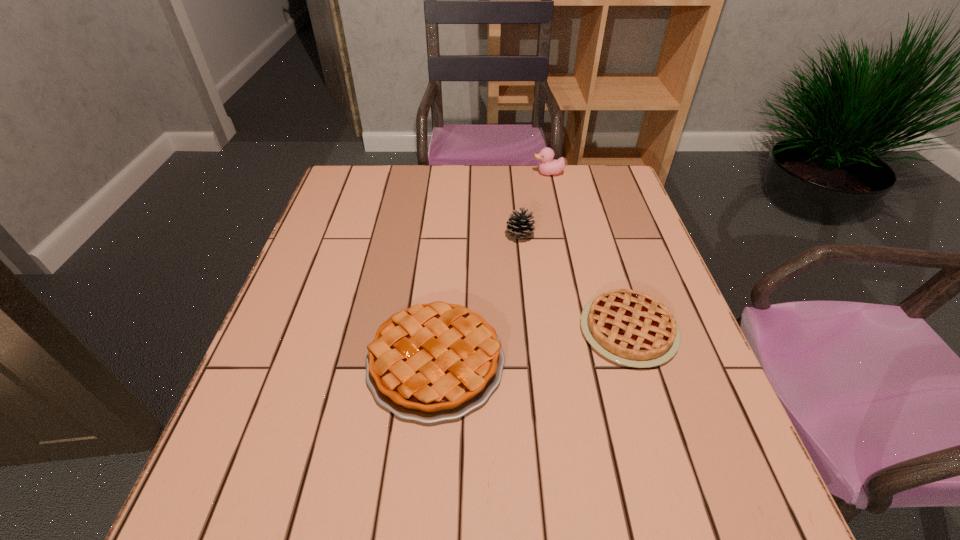
This screenshot has height=540, width=960. In the image, there is a desktop. Find the location of `vacant space at the near right corner`. vacant space at the near right corner is located at coordinates (737, 507).

Where is `vacant area that lies between the right pie and the third object from right to left`? vacant area that lies between the right pie and the third object from right to left is located at coordinates (574, 283).

Identify the location of free space that is in between the leftmost object and the duckling. The width and height of the screenshot is (960, 540). (492, 267).

Locate an element on the screen. This screenshot has height=540, width=960. free space between the shorter pie and the third tallest object is located at coordinates (532, 346).

This screenshot has height=540, width=960. I want to click on vacant area that lies between the third object from right to left and the leftmost object, so click(478, 299).

Where is `empty location between the third object from right to left and the duckling`? empty location between the third object from right to left and the duckling is located at coordinates (535, 204).

I want to click on free space between the left pie and the pinecone, so (478, 299).

Where is `free space between the third object from right to left and the taller pie`? The image size is (960, 540). free space between the third object from right to left and the taller pie is located at coordinates (478, 299).

You are a GUI agent. You are given a task and a screenshot of the screen. Output one action in this format:
    pyautogui.click(x=<x>, y=<y>)
    Task: Click on the empty space that is in between the right pie and the left pie
    This screenshot has width=960, height=540.
    Given the screenshot: What is the action you would take?
    pyautogui.click(x=532, y=346)

Locate an element on the screen. Image resolution: width=960 pixels, height=540 pixels. vacant point located between the shorter pie and the leftmost object is located at coordinates (532, 346).